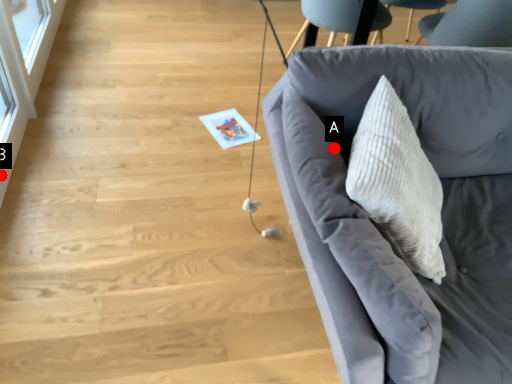
Question: Two points are circled on the image, labeled by A and B beside each circle. Among these points, which one is farthest from the camera?

Choices:
 (A) A is further
 (B) B is further

Answer: (B)